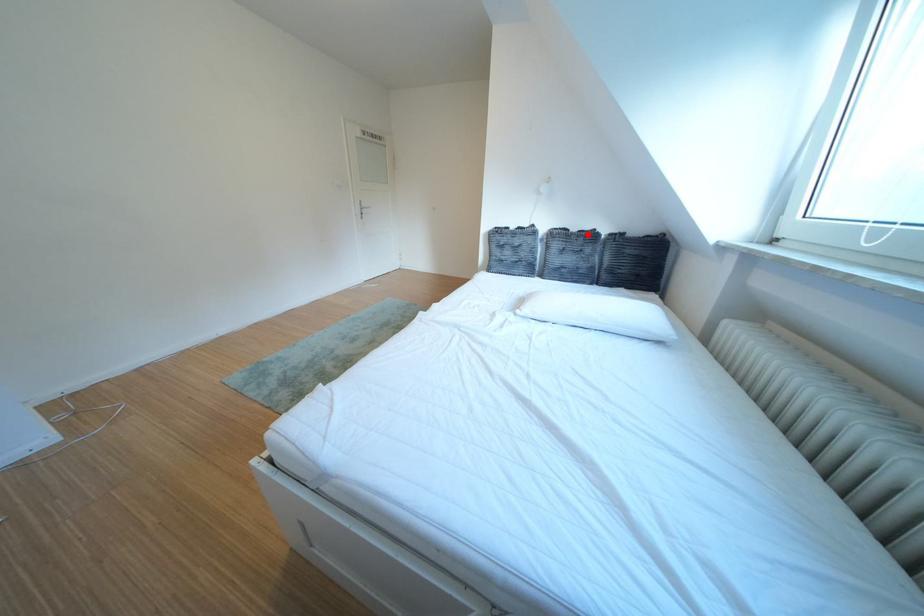
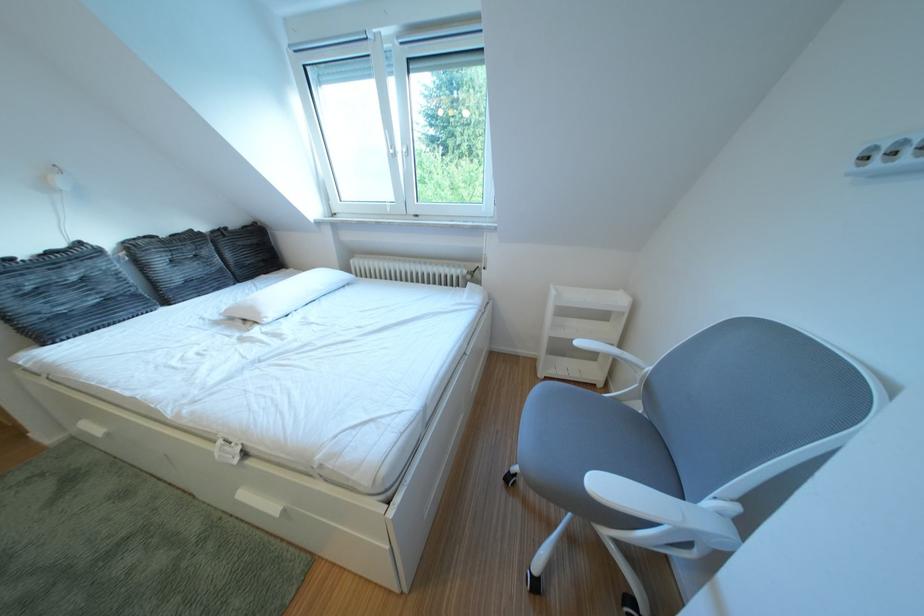
The point at the highlighted location is marked in the first image. Where is the corresponding point in the second image?

(176, 240)